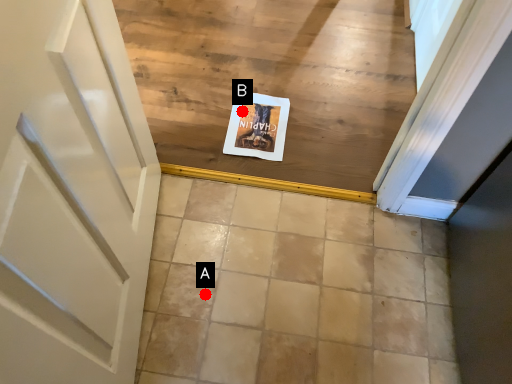
Question: Two points are circled on the image, labeled by A and B beside each circle. Which point is closer to the camera taking this photo?

Choices:
 (A) A is closer
 (B) B is closer

Answer: (A)